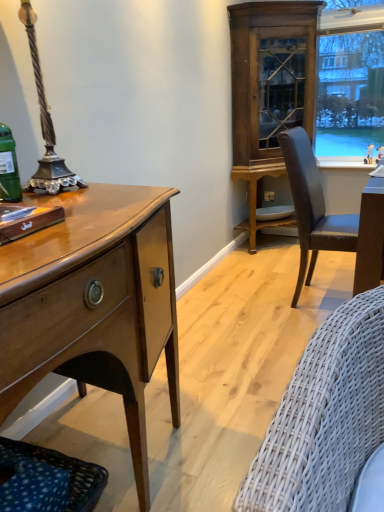
Question: Is the position of wooden cabinet at upper right less distant than that of dark blue woven fabric couch at lower left?

Choices:
 (A) yes
 (B) no

Answer: (B)

Question: From a real-world perspective, is wooden cabinet at upper right located beneath dark blue woven fabric couch at lower left?

Choices:
 (A) no
 (B) yes

Answer: (A)

Question: From the image's perspective, would you say wooden cabinet at upper right is shown under dark blue woven fabric couch at lower left?

Choices:
 (A) no
 (B) yes

Answer: (A)

Question: Considering the relative sizes of wooden cabinet at upper right and dark blue woven fabric couch at lower left in the image provided, is wooden cabinet at upper right smaller than dark blue woven fabric couch at lower left?

Choices:
 (A) no
 (B) yes

Answer: (A)

Question: Does wooden cabinet at upper right have a greater width compared to dark blue woven fabric couch at lower left?

Choices:
 (A) no
 (B) yes

Answer: (B)

Question: Considering the positions of leather-like chair at right and wooden cabinet at upper right in the image, is leather-like chair at right taller or shorter than wooden cabinet at upper right?

Choices:
 (A) short
 (B) tall

Answer: (A)

Question: Based on their sizes in the image, would you say leather-like chair at right is bigger or smaller than wooden cabinet at upper right?

Choices:
 (A) big
 (B) small

Answer: (B)

Question: Is leather-like chair at right situated inside wooden cabinet at upper right or outside?

Choices:
 (A) inside
 (B) outside

Answer: (B)

Question: Considering the relative positions of leather-like chair at right and wooden cabinet at upper right in the image provided, is leather-like chair at right to the left or to the right of wooden cabinet at upper right?

Choices:
 (A) left
 (B) right

Answer: (B)

Question: Would you say white glossy plate at lower center is to the left or to the right of leather-like chair at right in the picture?

Choices:
 (A) left
 (B) right

Answer: (A)

Question: From a real-world perspective, is white glossy plate at lower center physically located above or below leather-like chair at right?

Choices:
 (A) below
 (B) above

Answer: (A)

Question: Considering the positions of white glossy plate at lower center and leather-like chair at right in the image, is white glossy plate at lower center bigger or smaller than leather-like chair at right?

Choices:
 (A) small
 (B) big

Answer: (A)

Question: Is white glossy plate at lower center taller or shorter than leather-like chair at right?

Choices:
 (A) short
 (B) tall

Answer: (A)

Question: From a real-world perspective, is leather-like chair at right above or below white glossy plate at lower center?

Choices:
 (A) above
 (B) below

Answer: (A)

Question: Would you say leather-like chair at right is inside or outside white glossy plate at lower center?

Choices:
 (A) outside
 (B) inside

Answer: (A)